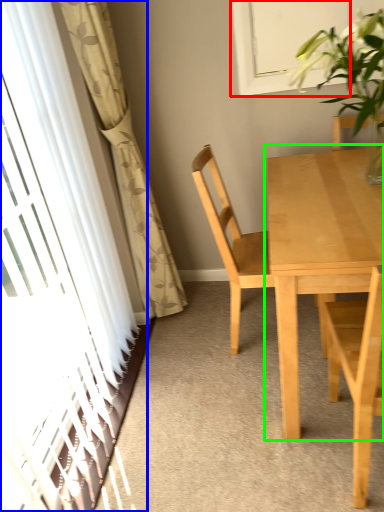
Question: Which object is positioned farthest from window (highlighted by a red box)? Select from screen door (highlighted by a blue box) and kitchen & dining room table (highlighted by a green box).

Choices:
 (A) screen door
 (B) kitchen & dining room table

Answer: (A)